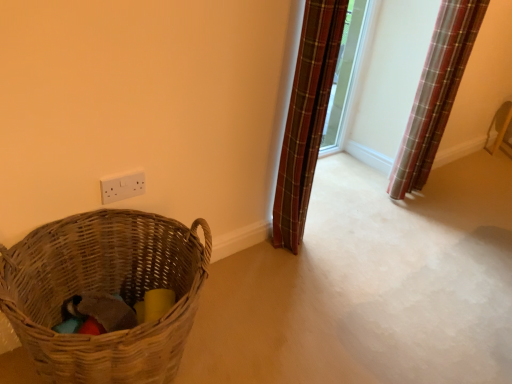
Question: In terms of width, does woven brown basket at lower left look wider or thinner when compared to white plastic electric outlet at upper center?

Choices:
 (A) thin
 (B) wide

Answer: (B)

Question: Is woven brown basket at lower left in front of or behind white plastic electric outlet at upper center in the image?

Choices:
 (A) front
 (B) behind

Answer: (A)

Question: Considering the real-world distances, which object is closest to the plaid fabric curtain at upper right, marked as the first curtain in a left-to-right arrangement?

Choices:
 (A) woven brown basket at lower left
 (B) plaid fabric curtain at right, placed as the first curtain when sorted from right to left
 (C) white plastic electric outlet at upper center

Answer: (C)

Question: Considering the real-world distances, which object is farthest from the white plastic electric outlet at upper center?

Choices:
 (A) woven brown basket at lower left
 (B) plaid fabric curtain at upper right, which is the second curtain in right-to-left order
 (C) plaid fabric curtain at right, the 2th curtain viewed from the left

Answer: (C)